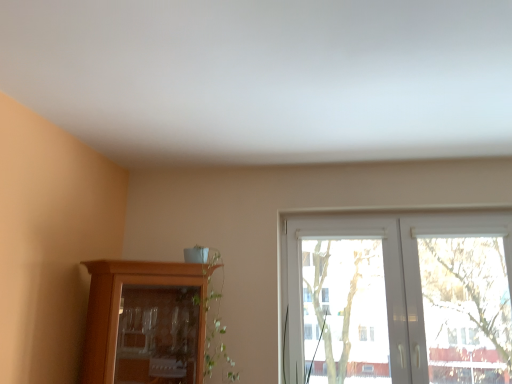
Where is `wooden cabinet at lower left`? wooden cabinet at lower left is located at coordinates (145, 322).

Describe the element at coordinates (145, 322) in the screenshot. I see `wooden cabinet at lower left` at that location.

In order to face white plastic window at center, should I rotate leftwards or rightwards?

A 18.946 degree turn to the right will do.

What do you see at coordinates (399, 299) in the screenshot? I see `white plastic window at center` at bounding box center [399, 299].

Locate an element on the screen. This screenshot has width=512, height=384. white plastic window at center is located at coordinates (399, 299).

The height and width of the screenshot is (384, 512). In order to click on wooden cabinet at lower left in this screenshot , I will do `click(145, 322)`.

Considering the positions of objects wooden cabinet at lower left and white plastic window at center in the image provided, who is more to the left, wooden cabinet at lower left or white plastic window at center?

wooden cabinet at lower left is more to the left.

Considering their positions, is wooden cabinet at lower left located in front of or behind white plastic window at center?

In the image, wooden cabinet at lower left appears in front of white plastic window at center.

Which is less distant, (94, 285) or (392, 300)?

Point (94, 285) appears to be closer to the viewer than point (392, 300).

From the image's perspective, is wooden cabinet at lower left under white plastic window at center?

Correct, wooden cabinet at lower left appears lower than white plastic window at center in the image.

From a real-world perspective, which is physically below, wooden cabinet at lower left or white plastic window at center?

wooden cabinet at lower left is physically lower.

Considering the sizes of objects wooden cabinet at lower left and white plastic window at center in the image provided, who is thinner, wooden cabinet at lower left or white plastic window at center?

white plastic window at center.

Considering the relative sizes of wooden cabinet at lower left and white plastic window at center in the image provided, is wooden cabinet at lower left shorter than white plastic window at center?

Yes.

Consider the image. Is wooden cabinet at lower left bigger or smaller than white plastic window at center?

In the image, wooden cabinet at lower left appears to be larger than white plastic window at center.

Is white plastic window at center inside wooden cabinet at lower left?

That's incorrect, white plastic window at center is not inside wooden cabinet at lower left.

Are wooden cabinet at lower left and white plastic window at center far apart?

That's right, there is a large distance between wooden cabinet at lower left and white plastic window at center.

In the scene shown: Does wooden cabinet at lower left turn towards white plastic window at center?

No, wooden cabinet at lower left does not turn towards white plastic window at center.

I want to click on cupboard lying below the white plastic window at center (from the image's perspective), so click(x=145, y=322).

Does white plastic window at center appear on the left side of wooden cabinet at lower left?

In fact, white plastic window at center is to the right of wooden cabinet at lower left.

Which is in front, white plastic window at center or wooden cabinet at lower left?

wooden cabinet at lower left is closer to the camera.

Which point is more forward, (461, 362) or (117, 292)?

The point (117, 292) is in front.

From the image's perspective, does white plastic window at center appear lower than wooden cabinet at lower left?

No, from the image's perspective, white plastic window at center is not below wooden cabinet at lower left.

From a real-world perspective, which object rests below the other?

wooden cabinet at lower left, from a real-world perspective.

Does white plastic window at center have a greater width compared to wooden cabinet at lower left?

Incorrect, the width of white plastic window at center does not surpass that of wooden cabinet at lower left.

Considering the sizes of white plastic window at center and wooden cabinet at lower left in the image, is white plastic window at center taller or shorter than wooden cabinet at lower left?

white plastic window at center is taller than wooden cabinet at lower left.

Is white plastic window at center bigger than wooden cabinet at lower left?

No.

Would you say white plastic window at center is inside or outside wooden cabinet at lower left?

The correct answer is: outside.

Is white plastic window at center positioned far away from wooden cabinet at lower left?

Yes.

Is white plastic window at center facing away from wooden cabinet at lower left?

No, white plastic window at center is not facing away from wooden cabinet at lower left.

How different are the orientations of white plastic window at center and wooden cabinet at lower left in degrees?

46.6 degrees separate the facing orientations of white plastic window at center and wooden cabinet at lower left.

Locate an element on the screen. The image size is (512, 384). cupboard beneath the white plastic window at center (from a real-world perspective) is located at coordinates (145, 322).

Locate an element on the screen. cupboard that is below the white plastic window at center (from the image's perspective) is located at coordinates (145, 322).

I want to click on window above the wooden cabinet at lower left (from a real-world perspective), so click(399, 299).